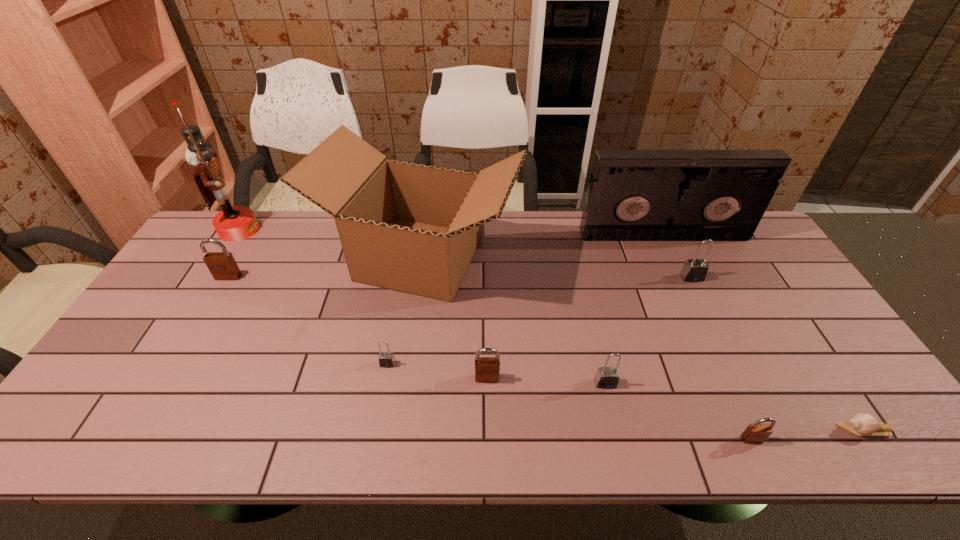
The image size is (960, 540). In order to click on padlock positioned at the near edge in this screenshot , I will do [755, 433].

Where is `escargot located in the near edge section of the desktop`? This screenshot has width=960, height=540. escargot located in the near edge section of the desktop is located at coordinates (862, 424).

Where is `nutcracker located in the left edge section of the desktop`? nutcracker located in the left edge section of the desktop is located at coordinates (233, 223).

Where is `padlock that is at the left edge`? This screenshot has height=540, width=960. padlock that is at the left edge is located at coordinates (222, 265).

Locate an element on the screen. The image size is (960, 540). videotape that is at the right edge is located at coordinates (633, 195).

Identify the location of escargot that is at the right edge. click(862, 424).

At what (x,y) coordinates should I click in order to perform the action: click on object at the far left corner. Please return your answer as a coordinate pair (x, y). The height and width of the screenshot is (540, 960). Looking at the image, I should click on (233, 223).

You are a GUI agent. You are given a task and a screenshot of the screen. Output one action in this format:
    pyautogui.click(x=<x>, y=<y>)
    Task: Click on the object at the far right corner
    
    Given the screenshot: What is the action you would take?
    pyautogui.click(x=633, y=195)

At what (x,y) coordinates should I click in order to perform the action: click on object positioned at the near right corner. Please return your answer as a coordinate pair (x, y). This screenshot has height=540, width=960. Looking at the image, I should click on (862, 424).

The image size is (960, 540). I want to click on vacant space at the far edge of the desktop, so click(267, 220).